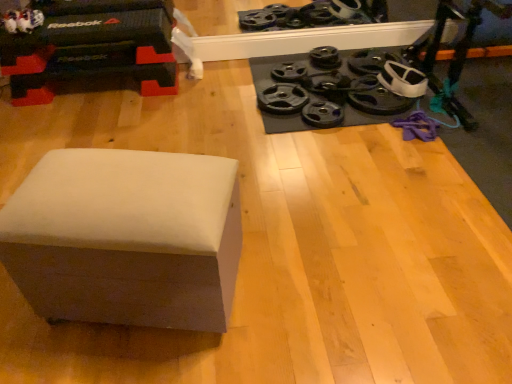
Question: Which direction should I rotate to look at black rubber weight plate at upper center, which ranks as the third wheel in right-to-left order, — up or down?

Choices:
 (A) down
 (B) up

Answer: (B)

Question: Can you confirm if black rubber weight plate at upper right, which is counted as the 6th wheel, starting from the right, is smaller than black rubber weight plate at upper right, the 6th wheel in the left-to-right sequence?

Choices:
 (A) no
 (B) yes

Answer: (B)

Question: From a real-world perspective, is black rubber weight plate at upper right, which is counted as the 6th wheel, starting from the right, under black rubber weight plate at upper right, the 6th wheel in the left-to-right sequence?

Choices:
 (A) no
 (B) yes

Answer: (B)

Question: Is black rubber weight plate at upper right, which is counted as the 6th wheel, starting from the right, touching black rubber weight plate at upper right, the 6th wheel in the left-to-right sequence?

Choices:
 (A) yes
 (B) no

Answer: (B)

Question: Is black rubber weight plate at upper right, acting as the 2th wheel starting from the left, positioned behind black rubber weight plate at upper right, the 6th wheel in the left-to-right sequence?

Choices:
 (A) yes
 (B) no

Answer: (A)

Question: From the image's perspective, is black rubber weight plate at upper right, acting as the 2th wheel starting from the left, below black rubber weight plate at upper right, positioned as the 2th wheel in right-to-left order?

Choices:
 (A) yes
 (B) no

Answer: (B)

Question: Is black rubber weight plate at upper right, positioned as the 2th wheel in right-to-left order, surrounded by black rubber weight plate at upper right, acting as the 2th wheel starting from the left?

Choices:
 (A) no
 (B) yes

Answer: (A)

Question: Does white plush toy at upper left have a larger size compared to black rubber weight plate at upper right, acting as the 2th wheel starting from the left?

Choices:
 (A) yes
 (B) no

Answer: (A)

Question: Would you say white plush toy at upper left is outside black rubber weight plate at upper right, acting as the 2th wheel starting from the left?

Choices:
 (A) no
 (B) yes

Answer: (B)

Question: Is white plush toy at upper left not near black rubber weight plate at upper right, which is counted as the 6th wheel, starting from the right?

Choices:
 (A) no
 (B) yes

Answer: (B)

Question: Is white plush toy at upper left further to the viewer compared to black rubber weight plate at upper right, acting as the 2th wheel starting from the left?

Choices:
 (A) no
 (B) yes

Answer: (A)

Question: Is white plush toy at upper left thinner than black rubber weight plate at upper right, acting as the 2th wheel starting from the left?

Choices:
 (A) no
 (B) yes

Answer: (A)

Question: Considering the relative sizes of white plush toy at upper left and black rubber weight plate at upper right, acting as the 2th wheel starting from the left, in the image provided, is white plush toy at upper left shorter than black rubber weight plate at upper right, acting as the 2th wheel starting from the left,?

Choices:
 (A) yes
 (B) no

Answer: (B)

Question: Is black rubber weight plate at upper right, which is counted as the 6th wheel, starting from the right, wider than black rubber weight plate at upper right, positioned as the 7th wheel in left-to-right order?

Choices:
 (A) yes
 (B) no

Answer: (B)